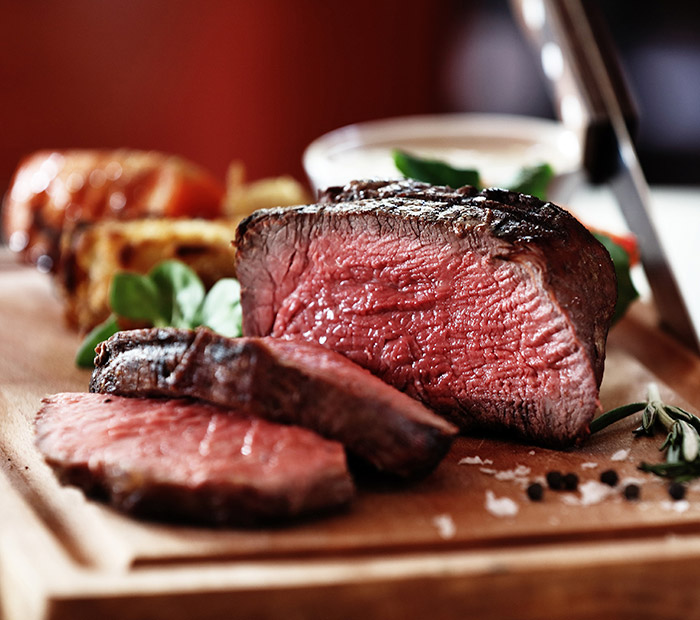
Where is `dish`? The image size is (700, 620). dish is located at coordinates (497, 130).